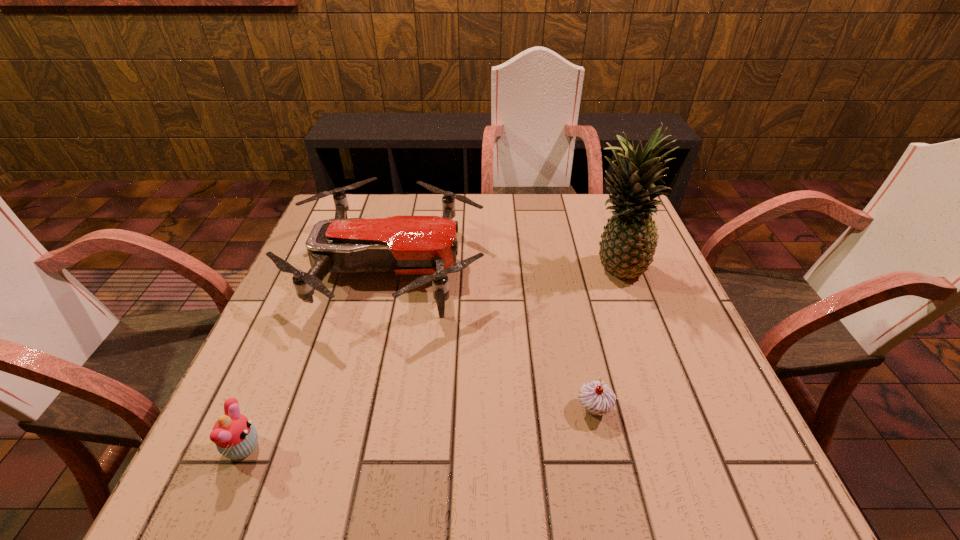
Choose which object is the third nearest neighbor to the third shortest object. Please provide its 2D coordinates. Your answer should be formatted as a tuple, i.e. [(x, y)], where the tuple contains the x and y coordinates of a point satisfying the conditions above.

[(628, 243)]

Locate an element on the screen. Image resolution: width=960 pixels, height=540 pixels. object that is the second closest one to the tallest object is located at coordinates (597, 398).

Find the location of a particular element. The image size is (960, 540). vacant region that satisfies the following two spatial constraints: 1. on the front-facing side of the third object from left to right; 2. on the right side of the drone is located at coordinates click(x=355, y=409).

I want to click on free location that satisfies the following two spatial constraints: 1. on the front side of the pineapple; 2. on the face of the left cupcake, so click(x=681, y=448).

Where is `free space that satisfies the following two spatial constraints: 1. on the front-facing side of the drone; 2. on the left side of the right cupcake`? The width and height of the screenshot is (960, 540). free space that satisfies the following two spatial constraints: 1. on the front-facing side of the drone; 2. on the left side of the right cupcake is located at coordinates (355, 409).

Image resolution: width=960 pixels, height=540 pixels. Identify the location of vacant point that satisfies the following two spatial constraints: 1. on the front-facing side of the second tallest object; 2. on the right side of the third object from left to right. (355, 409).

Image resolution: width=960 pixels, height=540 pixels. What are the coordinates of `vacant point that satisfies the following two spatial constraints: 1. on the front-facing side of the drone; 2. on the right side of the right cupcake` in the screenshot? It's located at (355, 409).